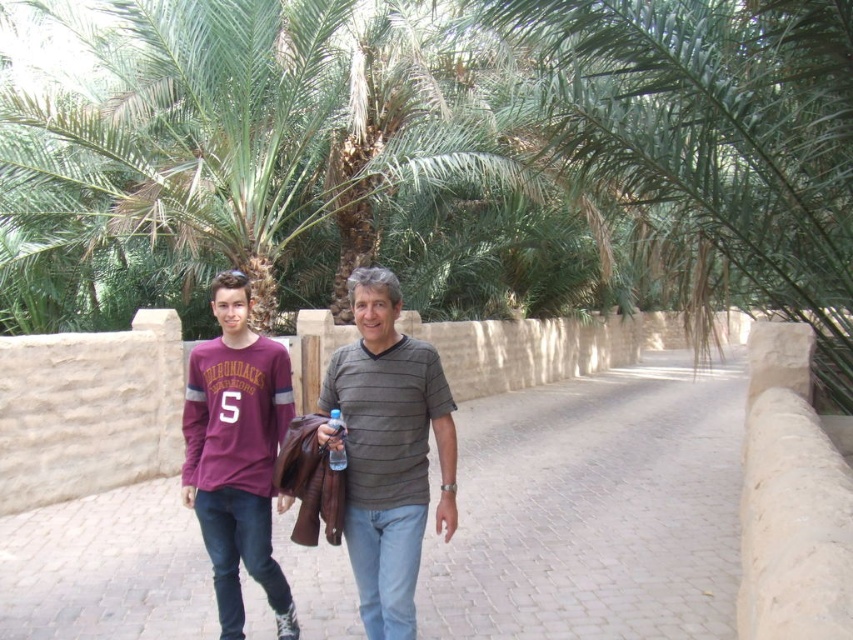
Question: Which point appears closest to the camera in this image?

Choices:
 (A) (283, 579)
 (B) (708, 616)
 (C) (335, 396)
 (D) (340, 458)

Answer: (D)

Question: Does gray striped shirt at center have a smaller size compared to maroon jersey at center?

Choices:
 (A) no
 (B) yes

Answer: (B)

Question: Can you confirm if paved stone walkway at center is thinner than transparent plastic bottle at center?

Choices:
 (A) no
 (B) yes

Answer: (A)

Question: Which is farther from the maroon jersey at center?

Choices:
 (A) gray striped shirt at center
 (B) paved stone walkway at center
 (C) transparent plastic bottle at center

Answer: (B)

Question: Which point is farther to the camera?

Choices:
 (A) transparent plastic bottle at center
 (B) gray striped shirt at center

Answer: (A)

Question: Can you confirm if paved stone walkway at center is thinner than maroon jersey at center?

Choices:
 (A) no
 (B) yes

Answer: (A)